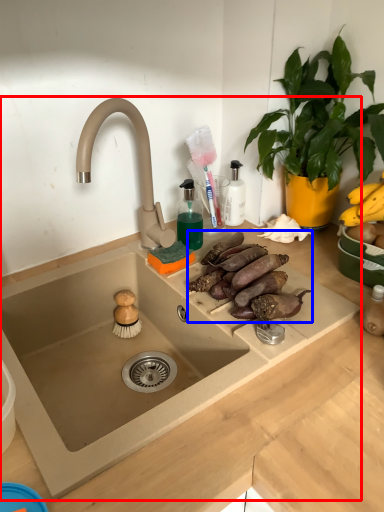
Question: Which object is further to the camera taking this photo, sink (highlighted by a red box) or food (highlighted by a blue box)?

Choices:
 (A) sink
 (B) food

Answer: (B)